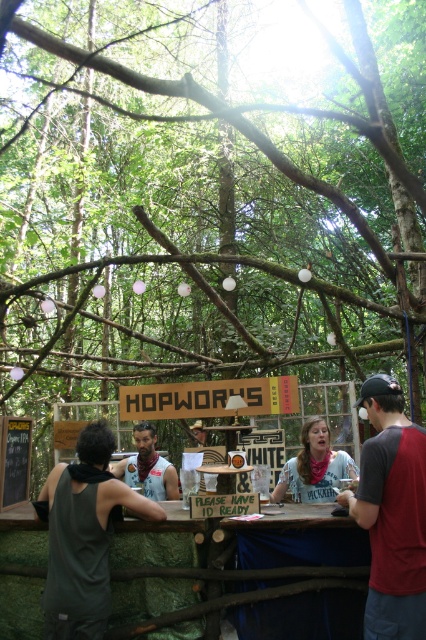
Consider the image. You are a photographer at the festival and want to capture both the white cotton shirt at center and the matte gray tank top at center in the same frame. Which clothing item should you focus on first to ensure both are in the shot?

The white cotton shirt at center is above the matte gray tank top at center, so you should focus on the matte gray tank top at center first to ensure both are in the shot.

Consider the image. You are at the festival bar and see two people wearing the white cotton shirt at center and the matte gray tank top at center. Which one is positioned to the right?

The white cotton shirt at center is positioned to the right of the matte gray tank top at center.